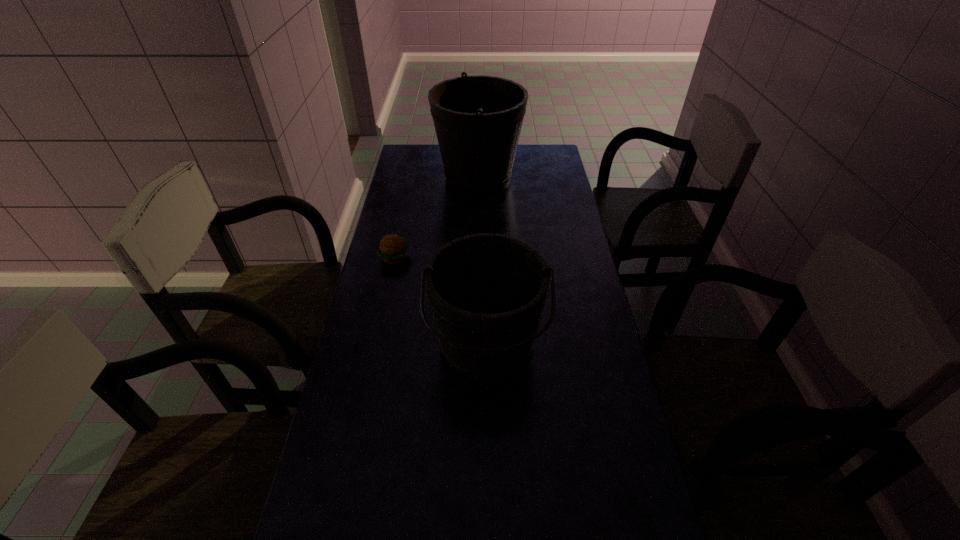
Identify the location of object present at the left edge. The width and height of the screenshot is (960, 540). (392, 249).

Find the location of `vacant space at the far edge of the desktop`. vacant space at the far edge of the desktop is located at coordinates (436, 165).

Locate an element on the screen. free space at the left edge is located at coordinates (395, 374).

You are a GUI agent. You are given a task and a screenshot of the screen. Output one action in this format:
    pyautogui.click(x=<x>, y=<y>)
    Task: Click on the vacant point at the right edge
    This screenshot has width=960, height=540.
    Given the screenshot: What is the action you would take?
    pyautogui.click(x=567, y=266)

At what (x,y) coordinates should I click in order to perform the action: click on vacant region at the far left corner of the desktop. Please return your answer as a coordinate pair (x, y). Image resolution: width=960 pixels, height=540 pixels. Looking at the image, I should click on (431, 148).

Image resolution: width=960 pixels, height=540 pixels. In order to click on free spot between the farther bucket and the second nearest object in this screenshot , I will do `click(437, 218)`.

Identify which object is the second closest to the second nearest object. Please provide its 2D coordinates. Your answer should be formatted as a tuple, i.e. [(x, y)], where the tuple contains the x and y coordinates of a point satisfying the conditions above.

[(478, 119)]

Where is `object that stands as the closest to the shortest object`? object that stands as the closest to the shortest object is located at coordinates (487, 291).